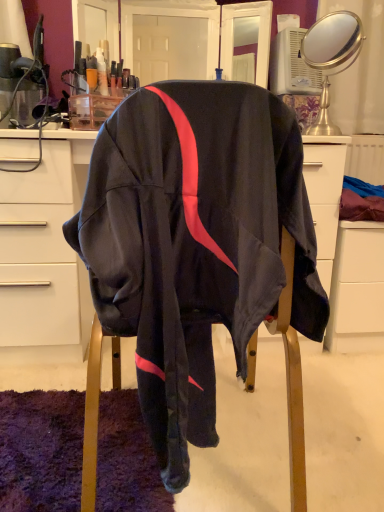
Question: Looking at their shapes, would you say gold metallic mirror at upper right is wider or thinner than matte white desk at center?

Choices:
 (A) wide
 (B) thin

Answer: (B)

Question: From the image's perspective, is gold metallic mirror at upper right positioned above or below matte white desk at center?

Choices:
 (A) below
 (B) above

Answer: (B)

Question: Which of these objects is positioned closest to the matte white desk at center?

Choices:
 (A) gold metallic mirror at upper right
 (B) white matte file cabinet at lower right

Answer: (B)

Question: Which is nearer to the matte white desk at center?

Choices:
 (A) gold metallic mirror at upper right
 (B) white matte file cabinet at lower right

Answer: (B)